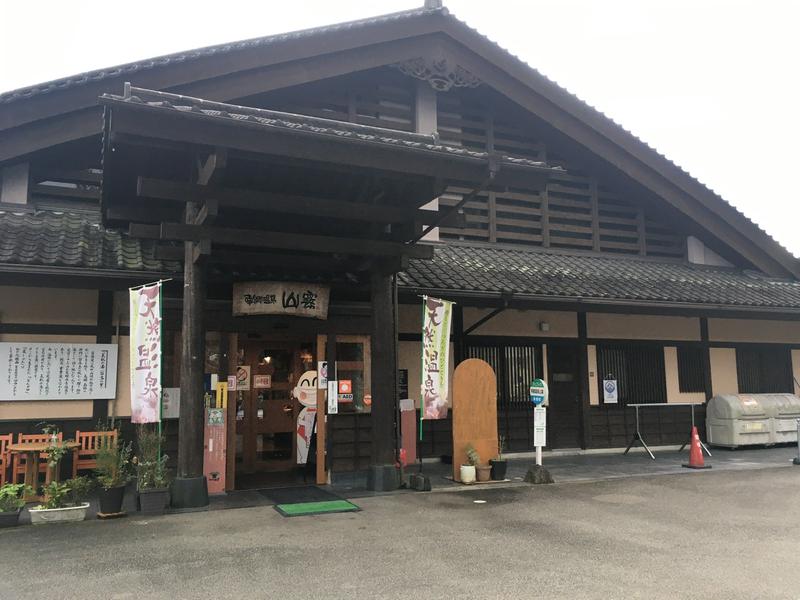
This screenshot has height=600, width=800. Identify the location of wooden chairs. (84, 459).